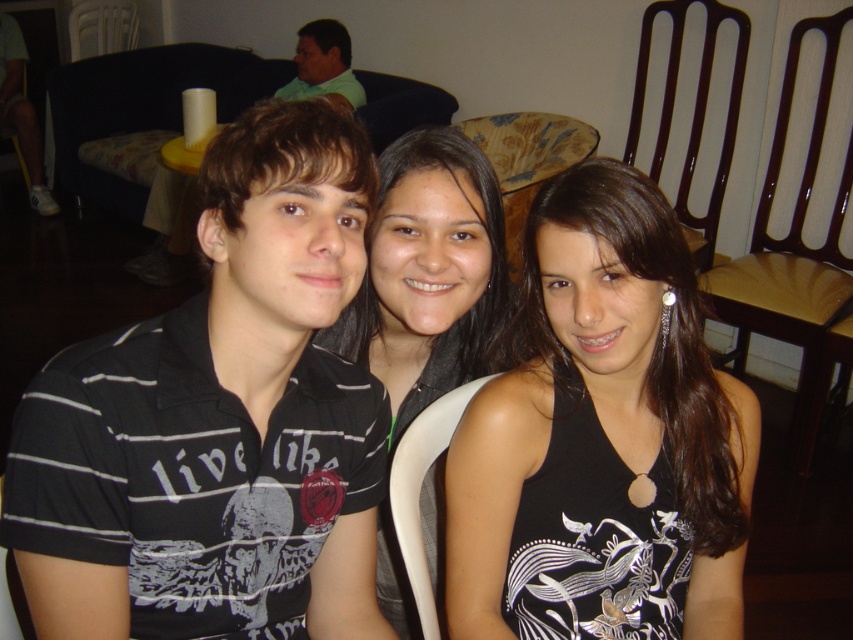
Measure the distance between black striped polo shirt at left and white matte shoe at lower left.

black striped polo shirt at left and white matte shoe at lower left are 4.29 meters apart.

Is black striped polo shirt at left to the right of white matte shoe at lower left from the viewer's perspective?

Correct, you'll find black striped polo shirt at left to the right of white matte shoe at lower left.

Which is behind, point (270, 333) or point (10, 17)?

The point (10, 17) is more distant.

The width and height of the screenshot is (853, 640). What are the coordinates of `black striped polo shirt at left` in the screenshot? It's located at (218, 420).

Does brown wood chair at right have a lesser width compared to dark brown wooden chair at right?

Incorrect, brown wood chair at right's width is not less than dark brown wooden chair at right's.

The width and height of the screenshot is (853, 640). What do you see at coordinates (793, 252) in the screenshot?
I see `brown wood chair at right` at bounding box center [793, 252].

Does point (837, 209) come closer to viewer compared to point (699, 104)?

Yes.

At what (x,y) coordinates should I click in order to perform the action: click on brown wood chair at right. Please return your answer as a coordinate pair (x, y). This screenshot has width=853, height=640. Looking at the image, I should click on (793, 252).

Can you confirm if patterned fabric chair at center is positioned to the left of white matte shoe at lower left?

No, patterned fabric chair at center is not to the left of white matte shoe at lower left.

Find the location of a particular element. patterned fabric chair at center is located at coordinates (526, 161).

Locate an element on the screen. patterned fabric chair at center is located at coordinates (526, 161).